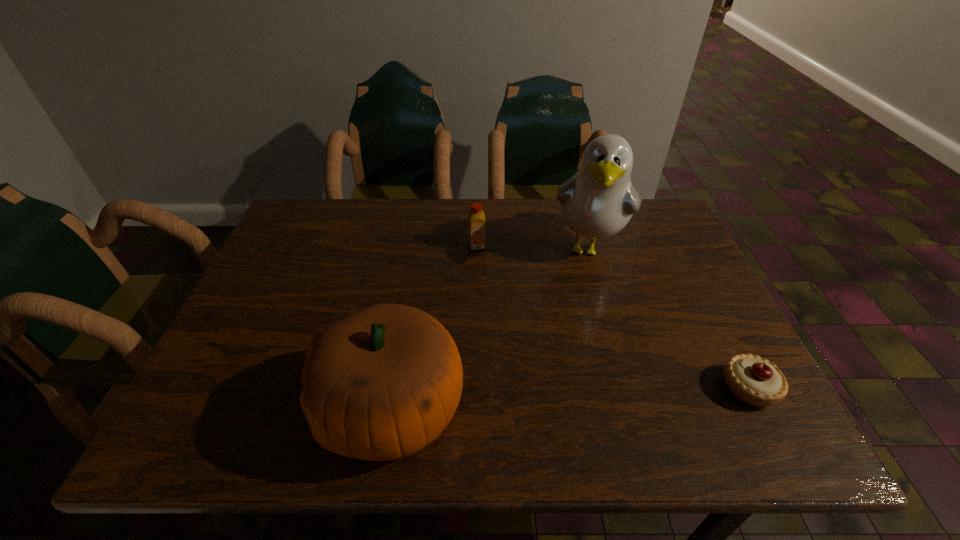
Image resolution: width=960 pixels, height=540 pixels. Identify the location of object that can be found as the closest to the shortest object. (597, 202).

Locate which object is the second closest to the third shortest object. Please provide its 2D coordinates. Your answer should be formatted as a tuple, i.e. [(x, y)], where the tuple contains the x and y coordinates of a point satisfying the conditions above.

[(476, 220)]

Where is `free space that satisfies the following two spatial constraints: 1. on the front side of the shortest object; 2. on the right side of the third object from left to right`? free space that satisfies the following two spatial constraints: 1. on the front side of the shortest object; 2. on the right side of the third object from left to right is located at coordinates (626, 388).

Where is `vacant point that satisfies the following two spatial constraints: 1. on the front side of the second object from right to left; 2. on the right side of the second shortest object`? The width and height of the screenshot is (960, 540). vacant point that satisfies the following two spatial constraints: 1. on the front side of the second object from right to left; 2. on the right side of the second shortest object is located at coordinates (476, 247).